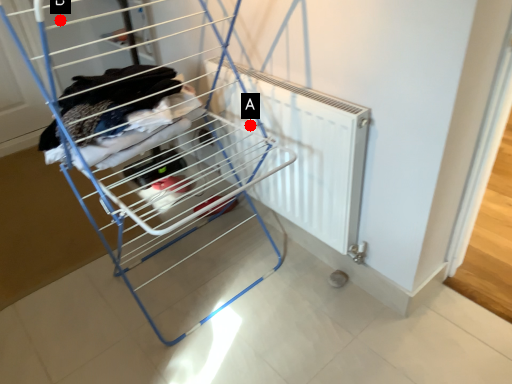
Question: Two points are circled on the image, labeled by A and B beside each circle. Which of the following is the closest to the observer?

Choices:
 (A) A is closer
 (B) B is closer

Answer: (B)